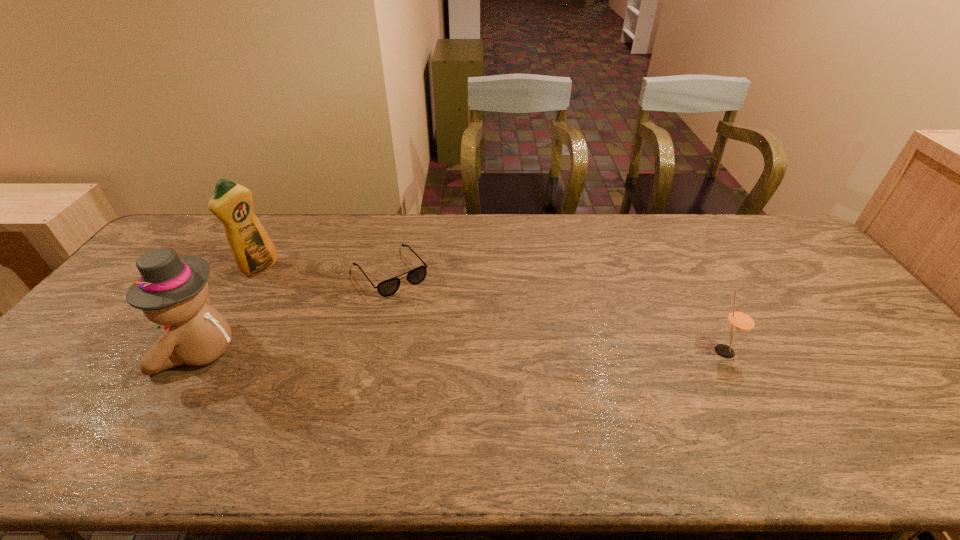
The image size is (960, 540). Find the location of `free spot on the desktop that is between the rag_doll and the rightmost object and is positioned on the front-facing side of the second object from right to left`. free spot on the desktop that is between the rag_doll and the rightmost object and is positioned on the front-facing side of the second object from right to left is located at coordinates (456, 351).

In order to click on vacant spot on the desktop that is between the rag_doll and the rightmost object and is positioned on the label of the detergent in this screenshot , I will do `click(420, 351)`.